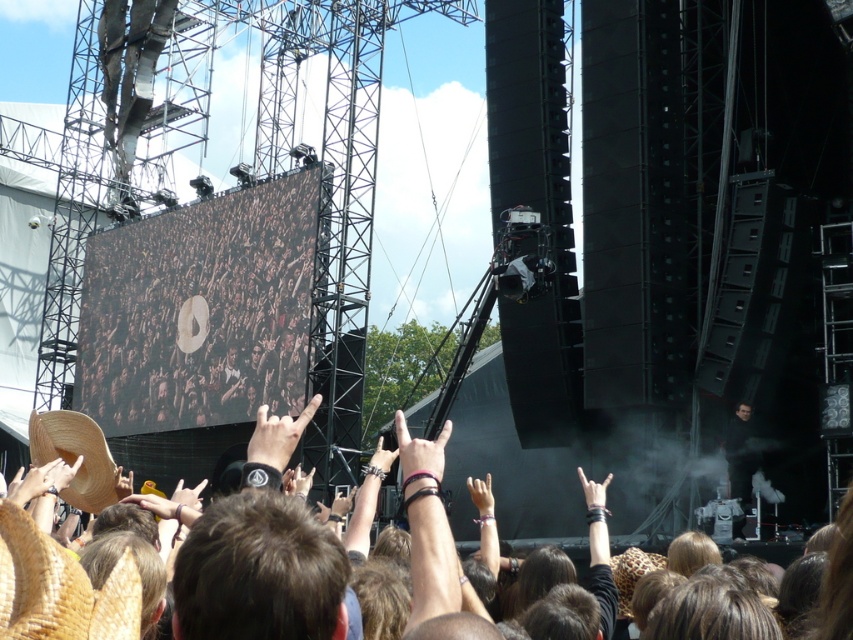
Question: Among these points, which one is nearest to the camera?

Choices:
 (A) (122, 406)
 (B) (45, 624)
 (C) (32, 460)

Answer: (B)

Question: Does natural straw hat at lower left come behind brown woven cowboy hat at lower left?

Choices:
 (A) yes
 (B) no

Answer: (B)

Question: Can you confirm if brown matte crowd at center is positioned to the right of natural straw hat at lower left?

Choices:
 (A) no
 (B) yes

Answer: (A)

Question: Which point is farther from the camera taking this photo?

Choices:
 (A) (96, 444)
 (B) (223, 298)
 (C) (68, 595)

Answer: (B)

Question: Is brown matte crowd at center closer to the viewer compared to brown woven cowboy hat at lower left?

Choices:
 (A) no
 (B) yes

Answer: (A)

Question: Which object appears farthest from the camera in this image?

Choices:
 (A) brown woven cowboy hat at lower left
 (B) natural straw hat at lower left

Answer: (A)